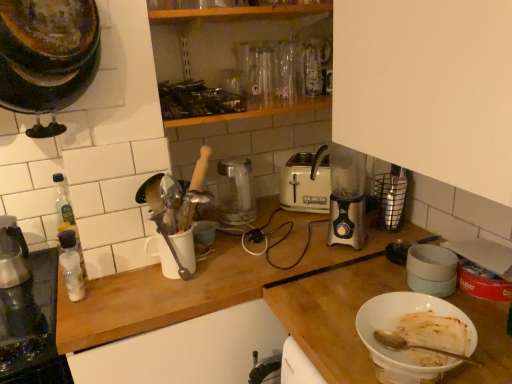
You are a GUI agent. You are given a task and a screenshot of the screen. Output one action in this format:
    pyautogui.click(x=<x>, y=<y>)
    Task: Click on the free spot to the left of silver metallic blender at center, the second kitchen appliance from the back
    The width and height of the screenshot is (512, 384).
    Given the screenshot: What is the action you would take?
    pyautogui.click(x=286, y=247)